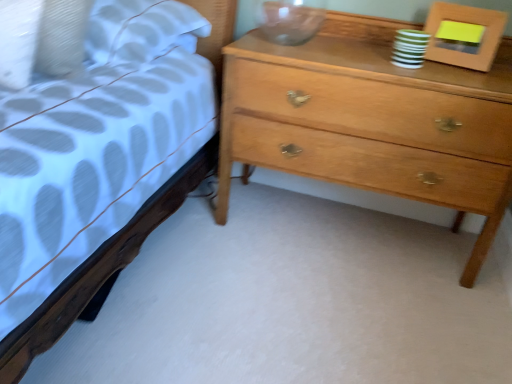
Where is `free location to the left of wooden picture frame at upper right`? free location to the left of wooden picture frame at upper right is located at coordinates (403, 66).